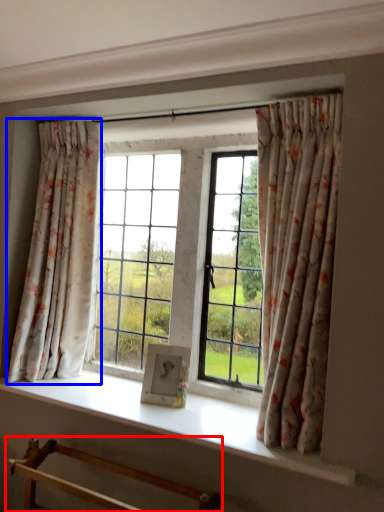
Question: Among these objects, which one is nearest to the camera, furniture (highlighted by a red box) or curtain (highlighted by a blue box)?

Choices:
 (A) furniture
 (B) curtain

Answer: (A)